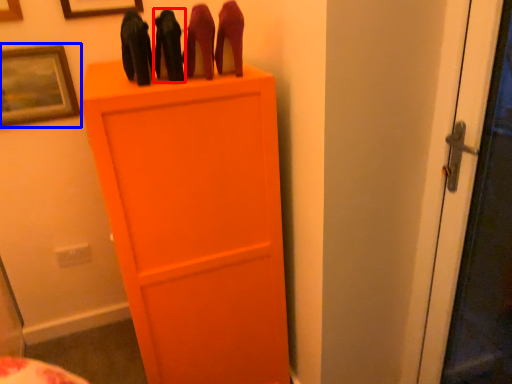
Question: Which point is further to the camera, stuff (highlighted by a red box) or picture frame (highlighted by a blue box)?

Choices:
 (A) stuff
 (B) picture frame

Answer: (B)